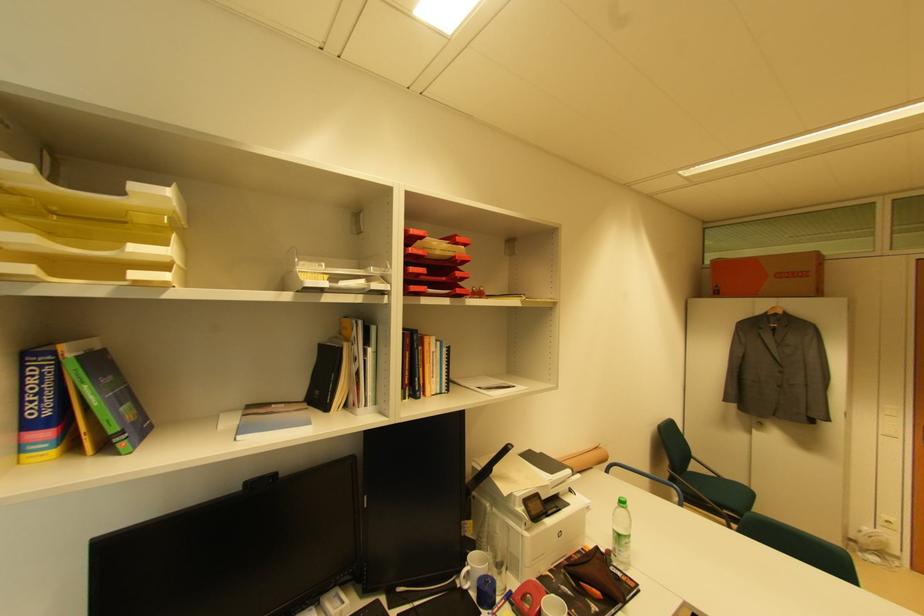
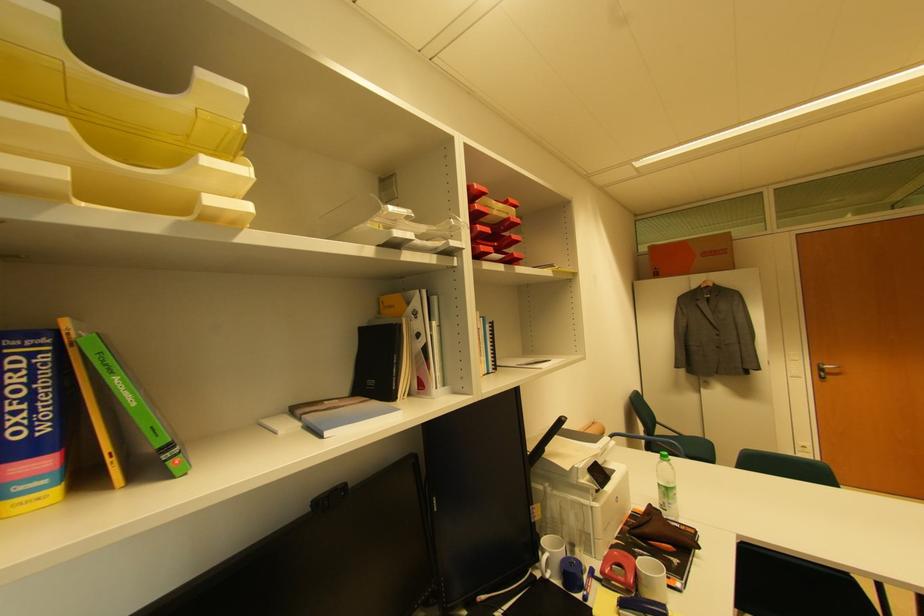
Question: The camera is either moving clockwise (left) or counter-clockwise (right) around the object. The first image is from the beginning of the video and the second image is from the end. Is the camera moving left or right when shooting the video?

Choices:
 (A) Left
 (B) Right

Answer: (A)